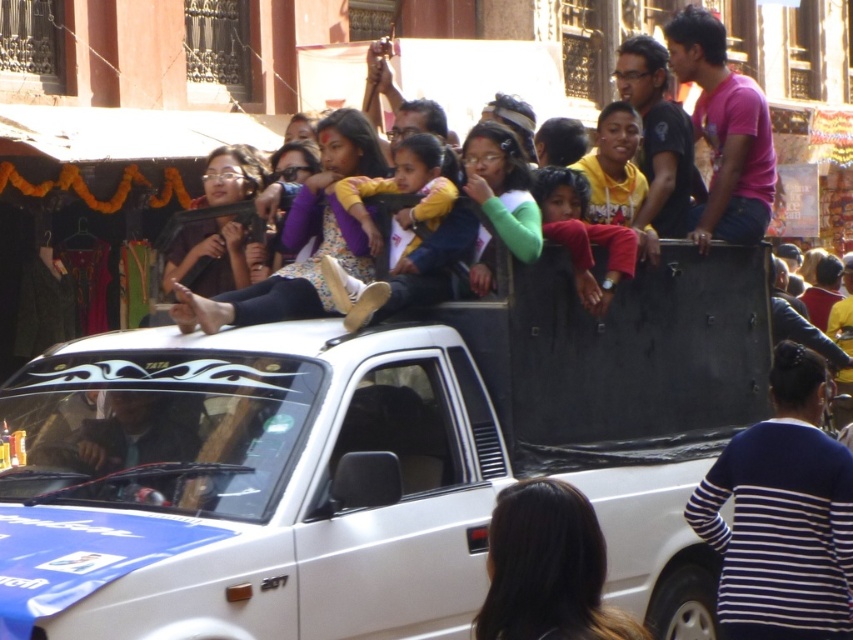
Question: Can you confirm if white matte truck at center is bigger than yellow fabric jacket at center?

Choices:
 (A) yes
 (B) no

Answer: (A)

Question: Estimate the real-world distances between objects in this image. Which object is farther from the yellow fabric jacket at center?

Choices:
 (A) white matte truck at center
 (B) red fabric child at center
 (C) black matte truck at center
 (D) pink matte shirt at upper right

Answer: (C)

Question: Estimate the real-world distances between objects in this image. Which object is closer to the red fabric child at center?

Choices:
 (A) yellow fabric jacket at center
 (B) black matte truck at center
 (C) pink matte shirt at upper right

Answer: (A)

Question: Is white matte truck at center closer to the viewer compared to pink matte shirt at upper right?

Choices:
 (A) yes
 (B) no

Answer: (A)

Question: Can you confirm if black matte truck at center is positioned to the left of yellow fabric jacket at center?

Choices:
 (A) no
 (B) yes

Answer: (A)

Question: Estimate the real-world distances between objects in this image. Which object is closer to the pink matte shirt at upper right?

Choices:
 (A) black matte truck at center
 (B) yellow fabric jacket at center
 (C) red fabric child at center

Answer: (C)